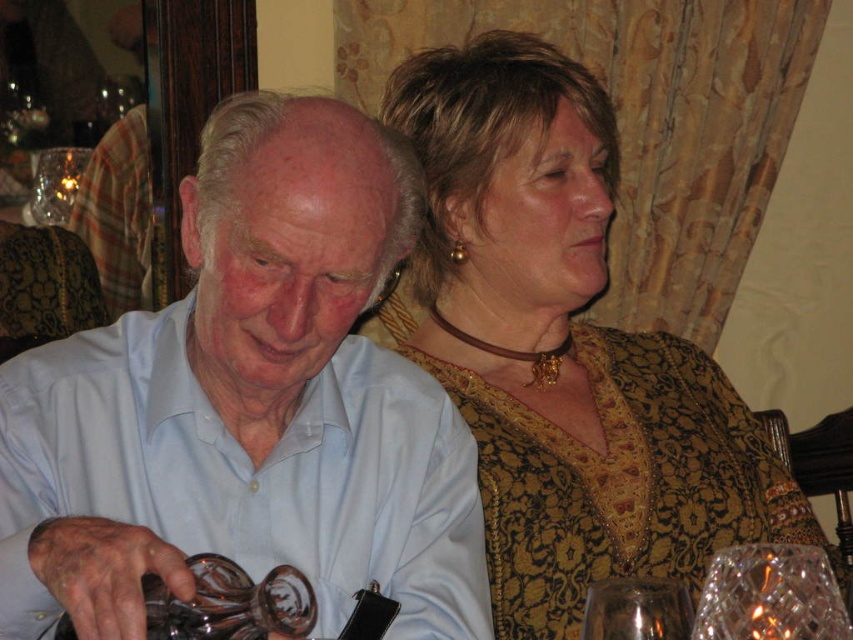
You are a server at a formal event and need to place a new drink order between the crystal clear glass at lower right and the clear glass bottle at lower left. The drink requires 12 inches of space. Can you fit it there?

The distance between the crystal clear glass at lower right and the clear glass bottle at lower left is 14.54 inches, which is more than enough to accommodate the 12 inches required for the drink order.

You are at a formal dinner and need to place a napkin on the table. The table has two points marked as point (779,566) and point (582,630). If you want to place the napkin closer to the person who is seated in front, which point should you choose?

Point (779,566) is in front of point (582,630), so placing the napkin at point (779,566) would be closer to the person seated in front.

You are a server at a formal event and need to deliver a drink to the guest holding the crystal clear glass at lower right. The transparent glass at lower right is already occupied. Which glass should you avoid placing the drink in?

You should avoid placing the drink in the transparent glass at lower right because the crystal clear glass at lower right is to the right of it, and the transparent glass is already occupied.